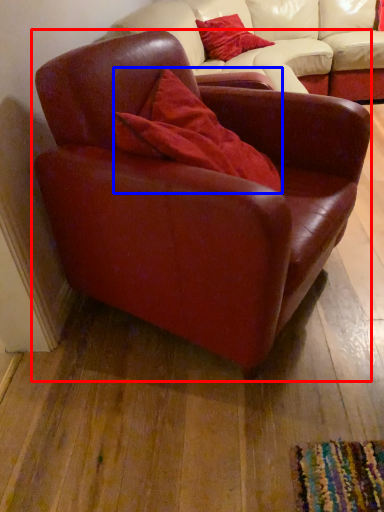
Question: Among these objects, which one is nearest to the camera, chair (highlighted by a red box) or pillow (highlighted by a blue box)?

Choices:
 (A) chair
 (B) pillow

Answer: (A)